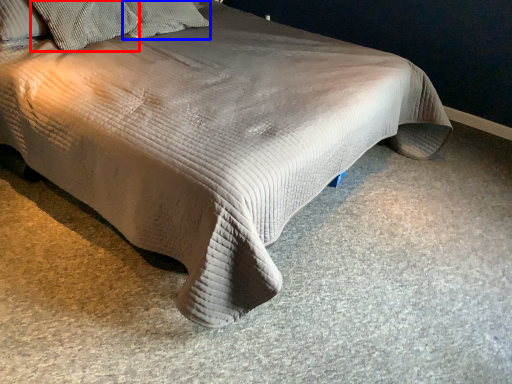
Question: Which object appears farthest to the camera in this image, pillow (highlighted by a red box) or pillow (highlighted by a blue box)?

Choices:
 (A) pillow
 (B) pillow

Answer: (B)